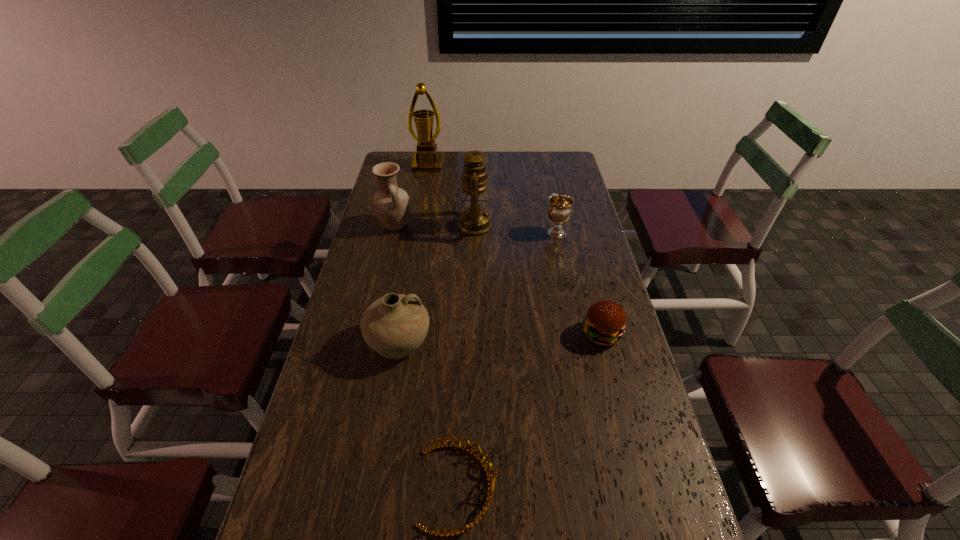
Identify the location of award. (x=426, y=159).

Locate an element on the screen. The width and height of the screenshot is (960, 540). the farthest object is located at coordinates pyautogui.click(x=426, y=159).

Find the location of a particular element. the sixth shortest object is located at coordinates (474, 221).

This screenshot has height=540, width=960. Identify the location of the farther pottery. (392, 205).

Identify the location of the third tallest object. (392, 205).

Find the location of a particular element. the nearer pottery is located at coordinates (395, 325).

The image size is (960, 540). In order to click on the fourth tallest object in this screenshot , I will do `click(395, 325)`.

I want to click on the third shortest object, so [560, 209].

Locate an element on the screen. The width and height of the screenshot is (960, 540). hamburger is located at coordinates (605, 321).

Locate an element on the screen. The image size is (960, 540). blank space located 0.300m on the front-facing side of the award is located at coordinates (420, 211).